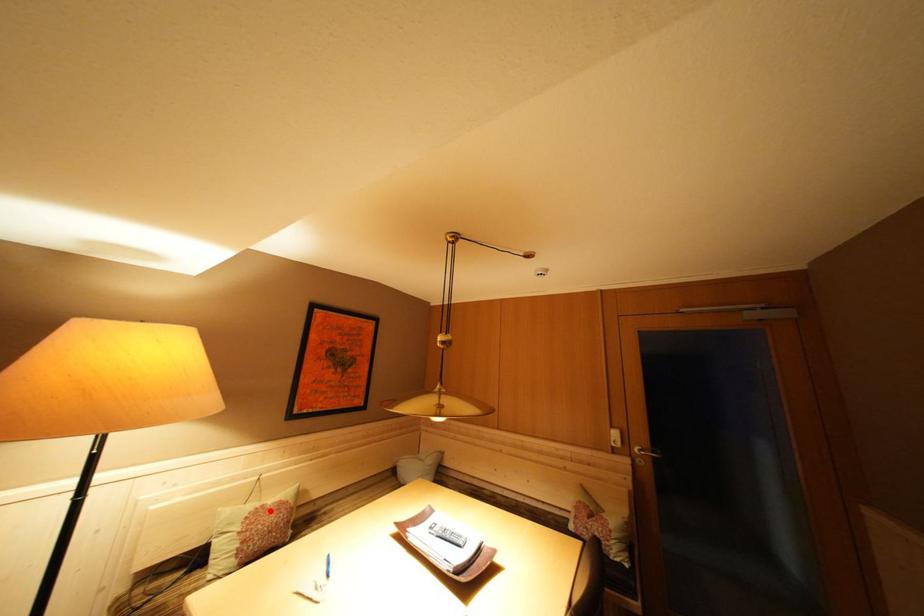
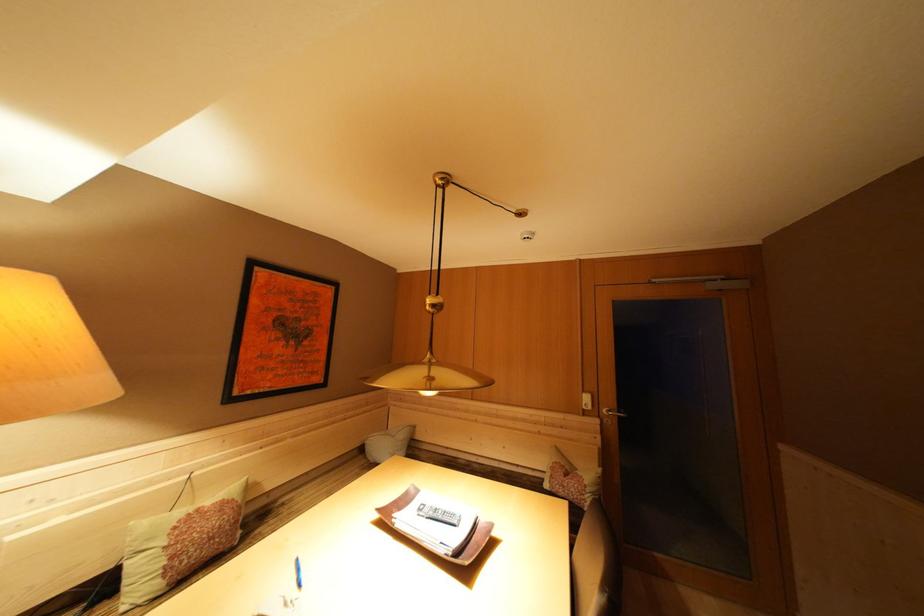
Question: I am providing you with two images of the same scene from different viewpoints. A red point is marked on the first image. Can you still see the location of the red point in image 2?

Choices:
 (A) Yes
 (B) No

Answer: (A)